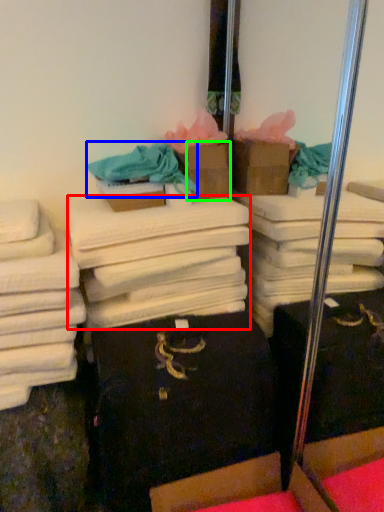
Question: Which is farther away from bath towel (highlighted by a red box)? clothing (highlighted by a blue box) or cardboard box (highlighted by a green box)?

Choices:
 (A) clothing
 (B) cardboard box

Answer: (B)